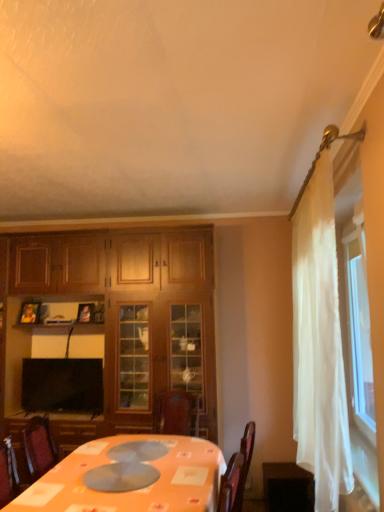
Question: Is black glossy tv at lower left completely or partially inside dark wood table at lower right?

Choices:
 (A) yes
 (B) no

Answer: (B)

Question: Can you confirm if dark wood table at lower right is positioned to the right of black glossy tv at lower left?

Choices:
 (A) yes
 (B) no

Answer: (A)

Question: Is dark wood table at lower right in contact with black glossy tv at lower left?

Choices:
 (A) no
 (B) yes

Answer: (A)

Question: Does dark wood table at lower right have a smaller size compared to black glossy tv at lower left?

Choices:
 (A) yes
 (B) no

Answer: (B)

Question: Is dark wood table at lower right at the left side of black glossy tv at lower left?

Choices:
 (A) no
 (B) yes

Answer: (A)

Question: Considering the relative positions of white sheer curtain at right and matte black picture frame at upper left, the 2th picture frame viewed from the left, in the image provided, is white sheer curtain at right to the left or to the right of matte black picture frame at upper left, the 2th picture frame viewed from the left,?

Choices:
 (A) right
 (B) left

Answer: (A)

Question: From a real-world perspective, is white sheer curtain at right physically located above or below matte black picture frame at upper left, the 2th picture frame viewed from the left?

Choices:
 (A) below
 (B) above

Answer: (A)

Question: In terms of width, does white sheer curtain at right look wider or thinner when compared to matte black picture frame at upper left, the 2th picture frame viewed from the left?

Choices:
 (A) wide
 (B) thin

Answer: (A)

Question: Do you think white sheer curtain at right is within matte black picture frame at upper left, the 2th picture frame viewed from the left, or outside of it?

Choices:
 (A) outside
 (B) inside

Answer: (A)

Question: Is wooden picture frame at upper left, which ranks as the 1th picture frame in left-to-right order, wider or thinner than wooden cabinet at left?

Choices:
 (A) wide
 (B) thin

Answer: (B)

Question: Is wooden picture frame at upper left, which is the second picture frame in right-to-left order, taller or shorter than wooden cabinet at left?

Choices:
 (A) tall
 (B) short

Answer: (B)

Question: Visually, is wooden picture frame at upper left, which is the second picture frame in right-to-left order, positioned to the left or to the right of wooden cabinet at left?

Choices:
 (A) right
 (B) left

Answer: (B)

Question: Is wooden picture frame at upper left, which is the second picture frame in right-to-left order, situated inside wooden cabinet at left or outside?

Choices:
 (A) inside
 (B) outside

Answer: (A)

Question: Visually, is black glossy tv at lower left positioned to the left or to the right of dark wood table at lower right?

Choices:
 (A) right
 (B) left

Answer: (B)

Question: From a real-world perspective, is black glossy tv at lower left above or below dark wood table at lower right?

Choices:
 (A) below
 (B) above

Answer: (B)